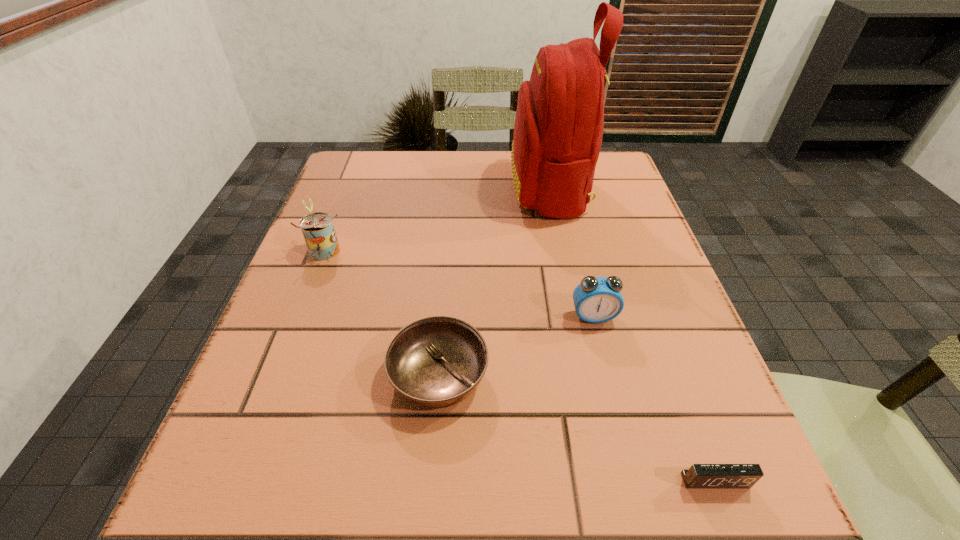
Where is `backpack positioned at the right edge`? This screenshot has width=960, height=540. backpack positioned at the right edge is located at coordinates (558, 130).

At what (x,y) coordinates should I click in order to perform the action: click on object that is at the far right corner. Please return your answer as a coordinate pair (x, y). Looking at the image, I should click on (558, 130).

I want to click on object that is at the near right corner, so [x=699, y=476].

Where is `blank area at the far edge`? blank area at the far edge is located at coordinates (445, 183).

Identify the location of vacant space at the near edge of the desktop. (314, 536).

In the image, there is a desktop. Where is `vacant region at the left edge`? This screenshot has width=960, height=540. vacant region at the left edge is located at coordinates (327, 265).

Find the location of a particular element. The height and width of the screenshot is (540, 960). free region at the right edge of the desktop is located at coordinates (636, 237).

Where is `vacant space at the far left corner of the desktop`? Image resolution: width=960 pixels, height=540 pixels. vacant space at the far left corner of the desktop is located at coordinates (351, 159).

This screenshot has height=540, width=960. In order to click on vacant space at the far right corner of the desktop in this screenshot , I will do `click(604, 185)`.

Where is `unoccupied position between the second tallest object and the left alarm clock`? This screenshot has width=960, height=540. unoccupied position between the second tallest object and the left alarm clock is located at coordinates (458, 283).